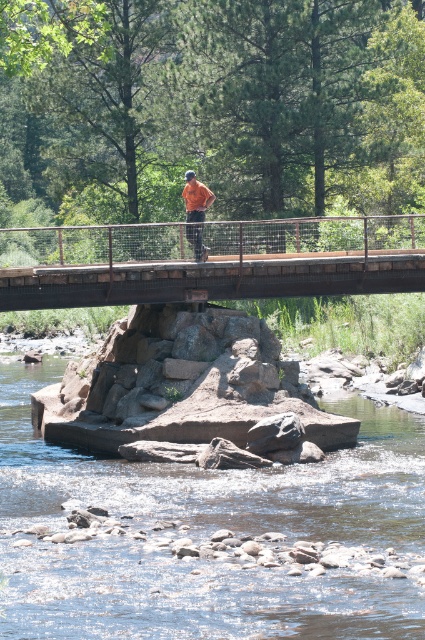
Question: Does smooth rock bed at center appear on the right side of brown wooden bridge at center?

Choices:
 (A) yes
 (B) no

Answer: (A)

Question: Considering the real-world distances, which object is closest to the orange fabric shirt at center?

Choices:
 (A) brown wooden bridge at center
 (B) smooth rock bed at center

Answer: (B)

Question: Is the position of smooth rock bed at center more distant than that of brown wooden bridge at center?

Choices:
 (A) no
 (B) yes

Answer: (A)

Question: Which is farther from the orange fabric shirt at center?

Choices:
 (A) smooth rock bed at center
 (B) brown wooden bridge at center

Answer: (B)

Question: Is smooth rock bed at center above orange fabric shirt at center?

Choices:
 (A) no
 (B) yes

Answer: (A)

Question: Considering the real-world distances, which object is farthest from the smooth rock bed at center?

Choices:
 (A) brown wooden bridge at center
 (B) orange fabric shirt at center

Answer: (A)